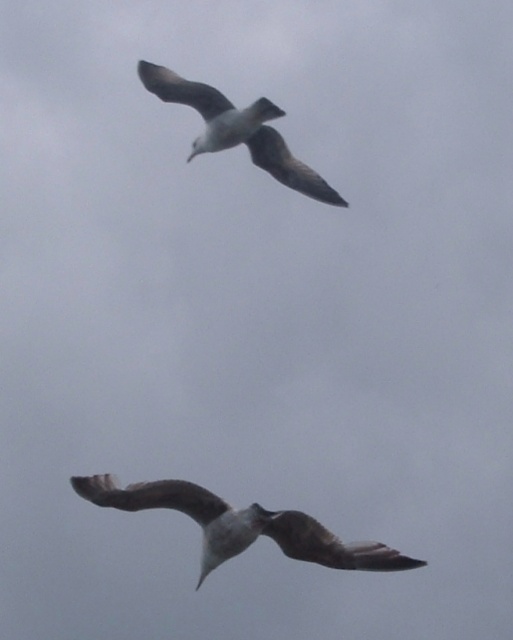
Question: Which object is closer to the camera taking this photo?

Choices:
 (A) white feathered bird at upper center
 (B) brown feathered bird at center

Answer: (B)

Question: Is brown feathered bird at center in front of white feathered bird at upper center?

Choices:
 (A) yes
 (B) no

Answer: (A)

Question: Which point is farther to the camera?

Choices:
 (A) pyautogui.click(x=168, y=80)
 (B) pyautogui.click(x=290, y=548)

Answer: (A)

Question: Is brown feathered bird at center to the right of white feathered bird at upper center from the viewer's perspective?

Choices:
 (A) yes
 (B) no

Answer: (A)

Question: Does brown feathered bird at center appear on the left side of white feathered bird at upper center?

Choices:
 (A) yes
 (B) no

Answer: (B)